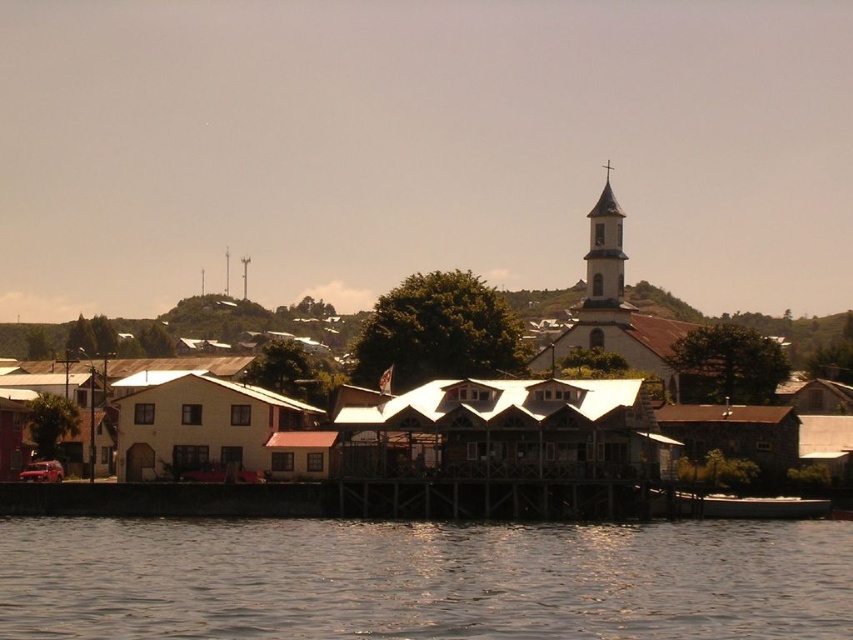
Can you confirm if brown water at lower center is positioned above white stucco bell tower at upper center?

Actually, brown water at lower center is below white stucco bell tower at upper center.

How distant is brown water at lower center from white stucco bell tower at upper center?

brown water at lower center and white stucco bell tower at upper center are 320.31 feet apart from each other.

Between point (643, 627) and point (619, 314), which one is positioned behind?

The point (619, 314) is more distant.

I want to click on brown water at lower center, so click(x=422, y=579).

Is brown water at lower center below metallic silver boat at lower center?

No.

What do you see at coordinates (422, 579) in the screenshot? The height and width of the screenshot is (640, 853). I see `brown water at lower center` at bounding box center [422, 579].

This screenshot has width=853, height=640. In order to click on brown water at lower center in this screenshot , I will do `click(422, 579)`.

Is point (402, 512) less distant than point (618, 298)?

Yes, point (402, 512) is in front of point (618, 298).

Can you confirm if brown wooden dock at center is shorter than white stucco bell tower at upper center?

Yes.

What do you see at coordinates (489, 499) in the screenshot? This screenshot has width=853, height=640. I see `brown wooden dock at center` at bounding box center [489, 499].

What are the coordinates of `brown wooden dock at center` in the screenshot? It's located at (489, 499).